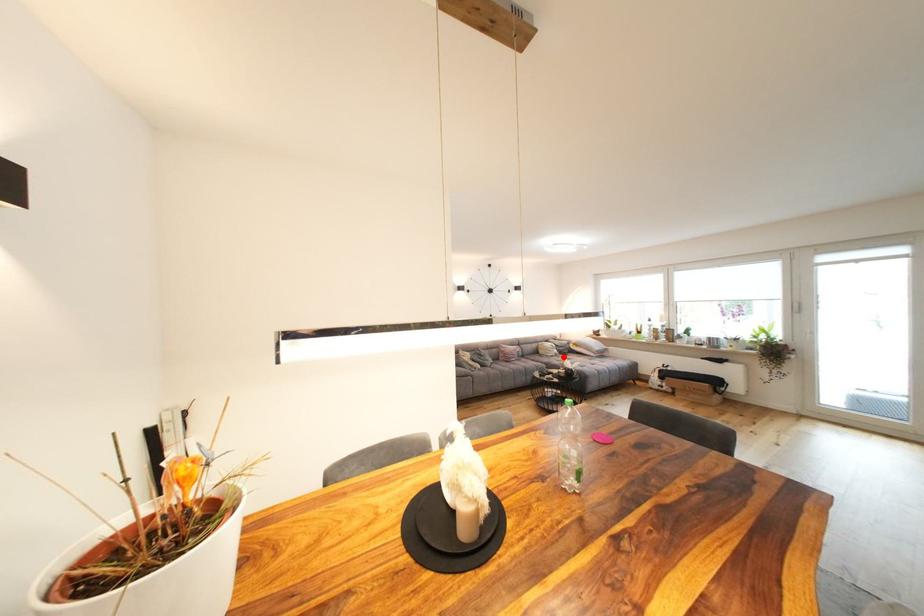
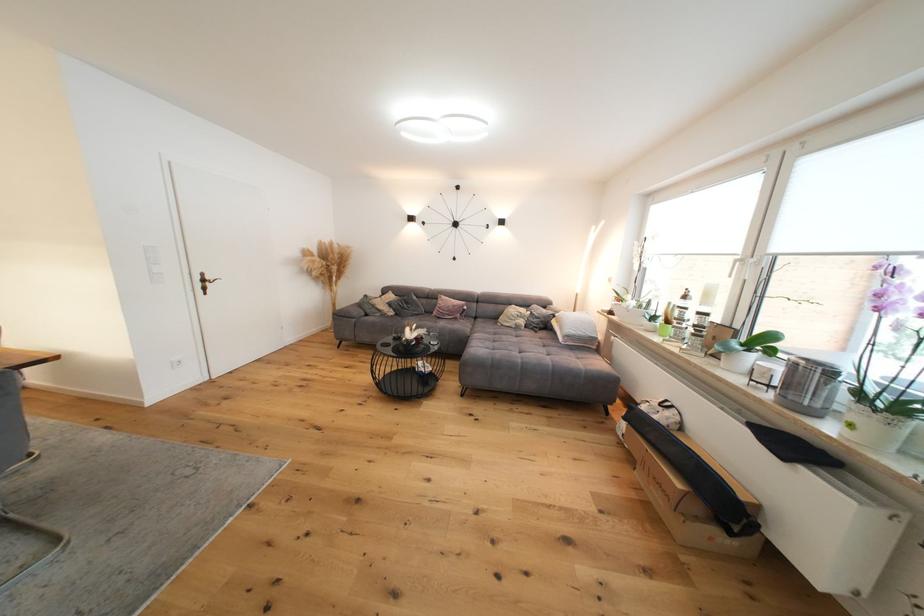
Question: I am providing you with two images of the same scene from different viewpoints. A red point is shown in image1. For the corresponding object point in image2, is it positioned nearer or farther from the camera?

Choices:
 (A) Nearer
 (B) Farther

Answer: (A)